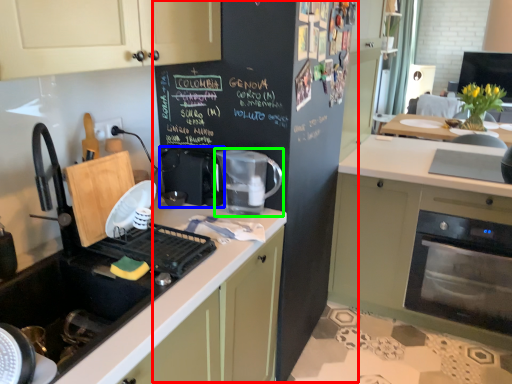
Question: Considering the real-world distances, which object is farthest from bulletin board (highlighted by a red box)? coffee machine (highlighted by a blue box) or kitchen appliance (highlighted by a green box)?

Choices:
 (A) coffee machine
 (B) kitchen appliance

Answer: (A)